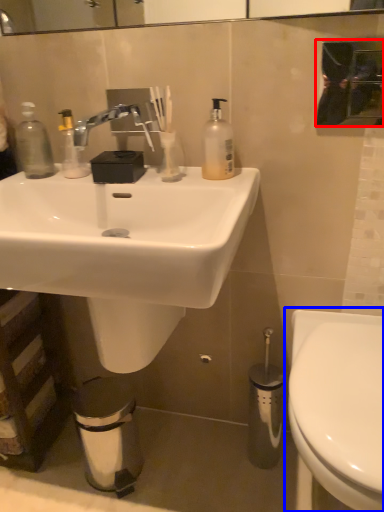
Question: Which object is further to the camera taking this photo, mirror (highlighted by a red box) or toilet (highlighted by a blue box)?

Choices:
 (A) mirror
 (B) toilet

Answer: (A)